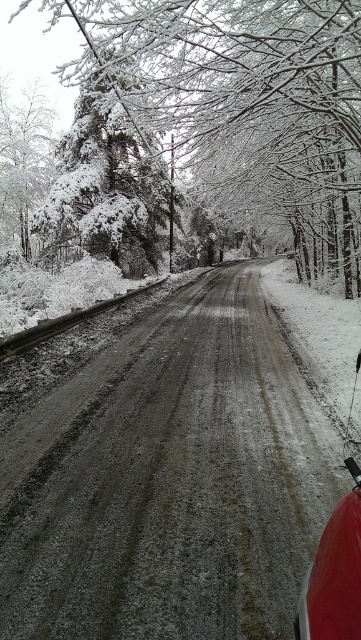
Question: Does dull gray gravel road at center appear on the left side of snow-covered tree at left?

Choices:
 (A) yes
 (B) no

Answer: (B)

Question: Does dull gray gravel road at center appear over shiny red car at lower right?

Choices:
 (A) yes
 (B) no

Answer: (B)

Question: Which of these objects is positioned farthest from the shiny red car at lower right?

Choices:
 (A) white snow-covered tree at left
 (B) snow-covered tree at left
 (C) snow-covered evergreen at left

Answer: (B)

Question: Which of the following is the closest to the observer?

Choices:
 (A) dull gray gravel road at center
 (B) white snow-covered tree at left

Answer: (A)

Question: Which of the following is the farthest from the observer?

Choices:
 (A) snow-covered evergreen at left
 (B) snow-covered tree at left
 (C) white snow-covered tree at left
 (D) dull gray gravel road at center

Answer: (B)

Question: Can you confirm if snow-covered evergreen at left is bigger than snow-covered tree at left?

Choices:
 (A) no
 (B) yes

Answer: (B)